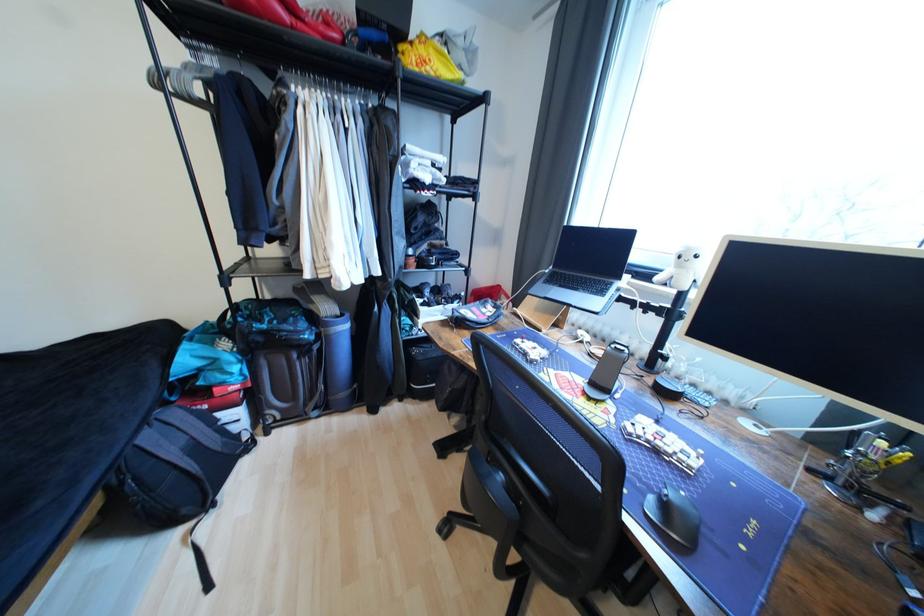
The location [682,268] corresponds to which object?

It corresponds to the white stuffed toy in the image.